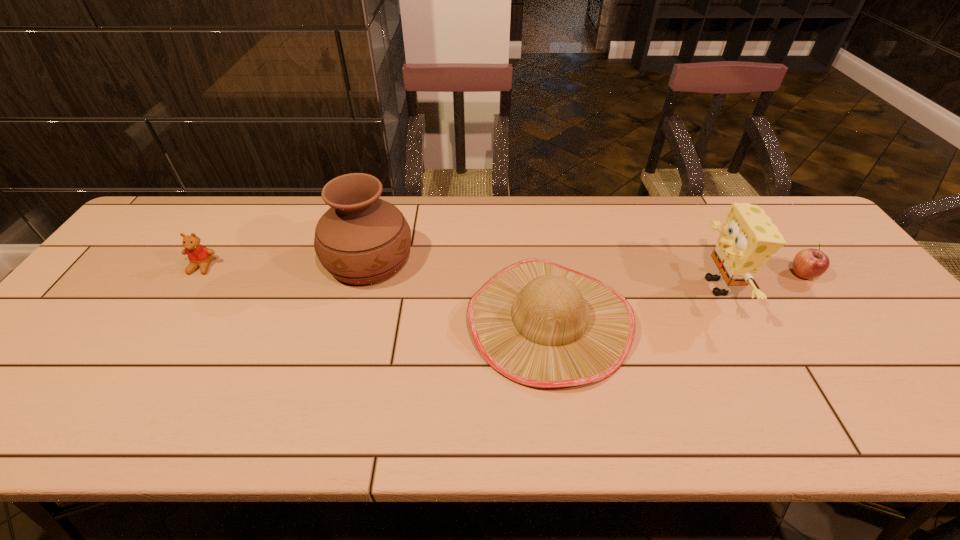
Identify which object is the closest to the shortest object. Please provide its 2D coordinates. Your answer should be formatted as a tuple, i.e. [(x, y)], where the tuple contains the x and y coordinates of a point satisfying the conditions above.

[(748, 239)]

Choose which object is the nearest neighbor to the third object from left to right. Please provide its 2D coordinates. Your answer should be formatted as a tuple, i.e. [(x, y)], where the tuple contains the x and y coordinates of a point satisfying the conditions above.

[(361, 239)]

I want to click on vacant space that satisfies the following two spatial constraints: 1. on the front side of the shortest object; 2. on the face of the sponge, so click(812, 286).

Identify the location of vacant region that satisfies the following two spatial constraints: 1. on the front-facing side of the leftmost object; 2. on the left side of the third shortest object. (167, 321).